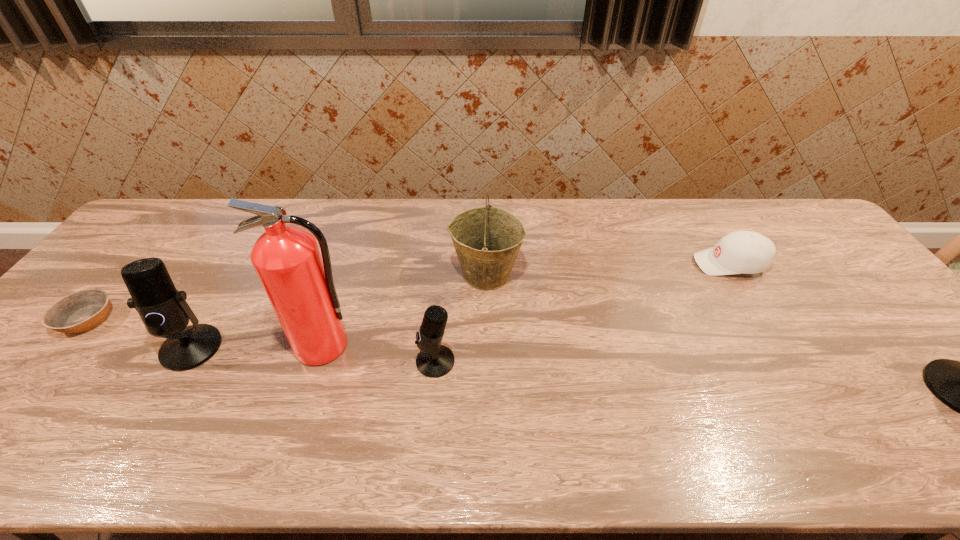
At what (x,y) coordinates should I click in order to perform the action: click on the tallest object. Please return your answer as a coordinate pair (x, y). The image size is (960, 540). Looking at the image, I should click on (299, 284).

Where is `vacant space located 0.080m on the stand of the leftmost microphone`? The height and width of the screenshot is (540, 960). vacant space located 0.080m on the stand of the leftmost microphone is located at coordinates (160, 402).

I want to click on vacant space situated 0.110m on the stand of the shortest microphone, so click(371, 361).

You are a GUI agent. You are given a task and a screenshot of the screen. Output one action in this format:
    pyautogui.click(x=<x>, y=<y>)
    Task: Click on the vacant space situated 0.330m on the stand of the shortest microphone
    
    Given the screenshot: What is the action you would take?
    pyautogui.click(x=281, y=361)

The image size is (960, 540). What are the coordinates of `free space located 0.090m on the stand of the shortest microphone` in the screenshot? It's located at (379, 361).

Find the location of `vacant region located on the front-facing side of the sixth tallest object`. vacant region located on the front-facing side of the sixth tallest object is located at coordinates (562, 264).

Where is `vacant space positioned 0.290m on the front-facing side of the sixth tallest object`? The image size is (960, 540). vacant space positioned 0.290m on the front-facing side of the sixth tallest object is located at coordinates (598, 264).

Image resolution: width=960 pixels, height=540 pixels. Find the location of `free space located on the front-facing side of the sixth tallest object`. free space located on the front-facing side of the sixth tallest object is located at coordinates (598, 264).

The image size is (960, 540). Identify the location of blank space located 0.260m on the back of the leftmost object. (154, 241).

Find the location of a particular element. The image size is (960, 540). vacant area situated 0.380m on the right of the wine bucket is located at coordinates (652, 274).